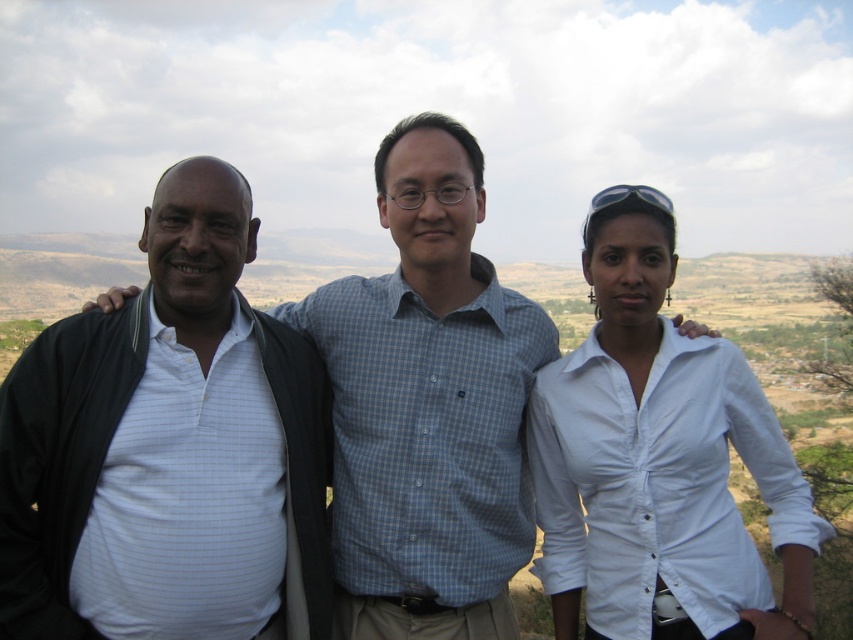
Question: Which point is closer to the camera taking this photo?

Choices:
 (A) (404, 627)
 (B) (175, 323)

Answer: (B)

Question: Can you confirm if white button-down shirt at center is smaller than white striped shirt at left?

Choices:
 (A) no
 (B) yes

Answer: (A)

Question: Which is nearer to the white button-down shirt at center?

Choices:
 (A) white shirt at center
 (B) white striped shirt at left

Answer: (A)

Question: Does white button-down shirt at center appear under white striped shirt at left?

Choices:
 (A) yes
 (B) no

Answer: (A)

Question: Can you confirm if white shirt at center is positioned to the right of white button-down shirt at center?

Choices:
 (A) no
 (B) yes

Answer: (A)

Question: Estimate the real-world distances between objects in this image. Which object is farther from the white shirt at center?

Choices:
 (A) white button-down shirt at center
 (B) white striped shirt at left

Answer: (B)